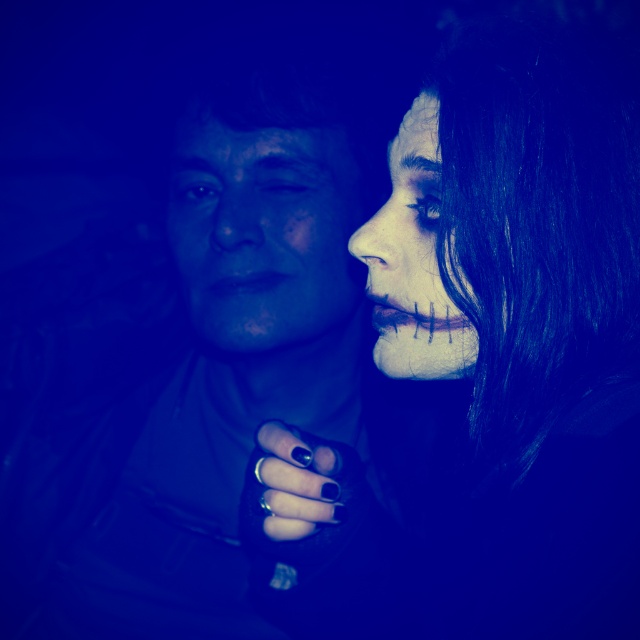
Question: Which point is closer to the camera?

Choices:
 (A) matte black face paint at right
 (B) matte black face at center

Answer: (A)

Question: Does matte black face paint at right lie behind matte black jacket at center?

Choices:
 (A) yes
 (B) no

Answer: (B)

Question: In this image, where is matte black face paint at right located relative to matte black jacket at center?

Choices:
 (A) right
 (B) left

Answer: (A)

Question: Which of the following is the closest to the observer?

Choices:
 (A) (108, 460)
 (B) (396, 193)
 (C) (557, 51)

Answer: (C)

Question: Is matte black face paint at right behind matte black jacket at center?

Choices:
 (A) yes
 (B) no

Answer: (B)

Question: Which of the following is the closest to the observer?

Choices:
 (A) (390, 349)
 (B) (179, 266)

Answer: (A)